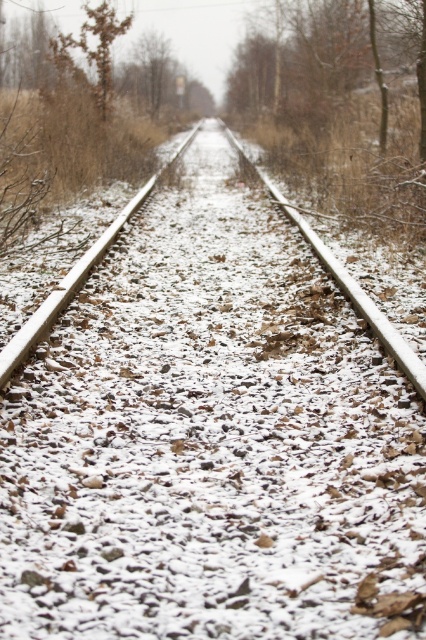
Can you confirm if brown wood tree at upper center is taller than brown textured tree at upper left?

Yes.

Which is below, brown wood tree at upper center or brown textured tree at upper left?

brown wood tree at upper center is below.

The width and height of the screenshot is (426, 640). What do you see at coordinates (328, 61) in the screenshot?
I see `brown wood tree at upper center` at bounding box center [328, 61].

At what (x,y) coordinates should I click in order to perform the action: click on brown wood tree at upper center. Please return your answer as a coordinate pair (x, y). Looking at the image, I should click on (328, 61).

Is snow-covered metal train track at center below brown textured tree at upper left?

Yes.

Is snow-covered metal train track at center to the left of brown textured tree at upper left from the viewer's perspective?

In fact, snow-covered metal train track at center is to the right of brown textured tree at upper left.

This screenshot has height=640, width=426. I want to click on snow-covered metal train track at center, so click(x=65, y=289).

Can you confirm if brown wood tree at upper center is taller than snow-covered metal train track at center?

Correct, brown wood tree at upper center is much taller as snow-covered metal train track at center.

Is brown wood tree at upper center to the left of snow-covered metal train track at center from the viewer's perspective?

No, brown wood tree at upper center is not to the left of snow-covered metal train track at center.

Measure the distance between brown wood tree at upper center and camera.

brown wood tree at upper center and camera are 10.66 meters apart from each other.

Find the location of a particular element. The image size is (426, 640). brown wood tree at upper center is located at coordinates (328, 61).